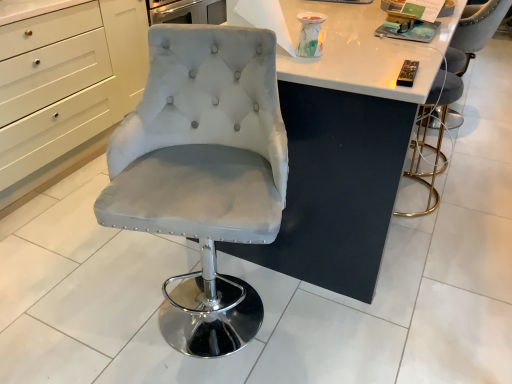
Identify the location of vacant space situated on the left part of satin white chair at center, arranged as the 3th chair when viewed from the right. (93, 316).